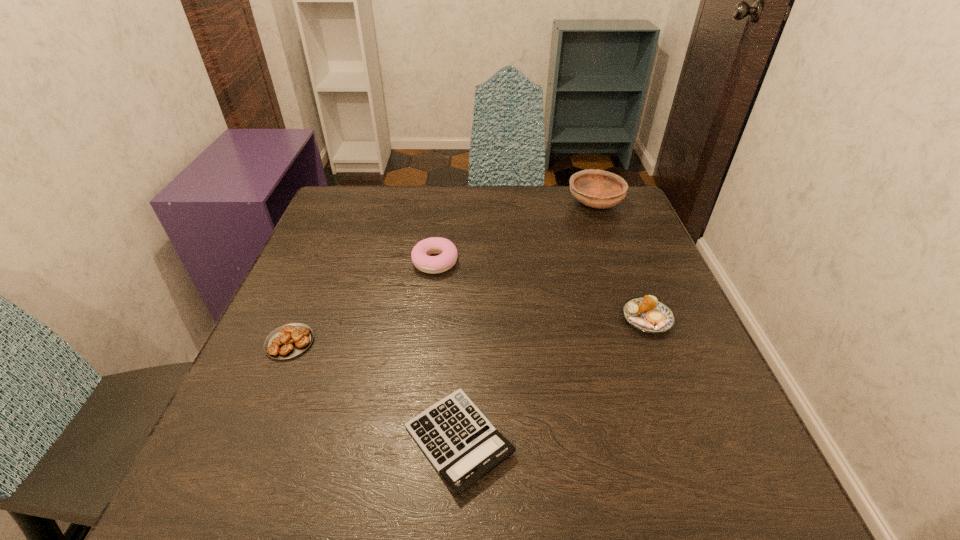
The width and height of the screenshot is (960, 540). Identify the location of blank area located 0.160m on the front of the tallest object. (614, 255).

I want to click on free space located 0.280m on the back of the second pastry from right to left, so click(x=444, y=188).

This screenshot has height=540, width=960. I want to click on vacant point located on the left of the rightmost pastry, so click(x=597, y=319).

You are a GUI agent. You are given a task and a screenshot of the screen. Output one action in this format:
    pyautogui.click(x=<x>, y=<y>)
    Task: Click on the vacant position located 0.140m on the right of the leftmost pastry
    The height and width of the screenshot is (540, 960).
    Given the screenshot: What is the action you would take?
    pyautogui.click(x=388, y=342)

Locate an element on the screen. vacant space located on the right of the shortest object is located at coordinates (612, 440).

Where is `object that is at the far edge`? This screenshot has width=960, height=540. object that is at the far edge is located at coordinates (600, 189).

The image size is (960, 540). In order to click on object present at the near edge in this screenshot , I will do `click(461, 443)`.

You are a GUI agent. You are given a task and a screenshot of the screen. Output one action in this format:
    pyautogui.click(x=<x>, y=<y>)
    Task: Click on the object that is at the left edge
    This screenshot has width=960, height=540.
    Given the screenshot: What is the action you would take?
    pyautogui.click(x=290, y=340)

Locate an element on the screen. bowl that is at the right edge is located at coordinates (600, 189).

You are a GUI agent. You are given a task and a screenshot of the screen. Output one action in this format:
    pyautogui.click(x=<x>, y=<y>)
    Task: Click on the pastry that is at the right edge
    This screenshot has height=540, width=960.
    Given the screenshot: What is the action you would take?
    (648, 314)